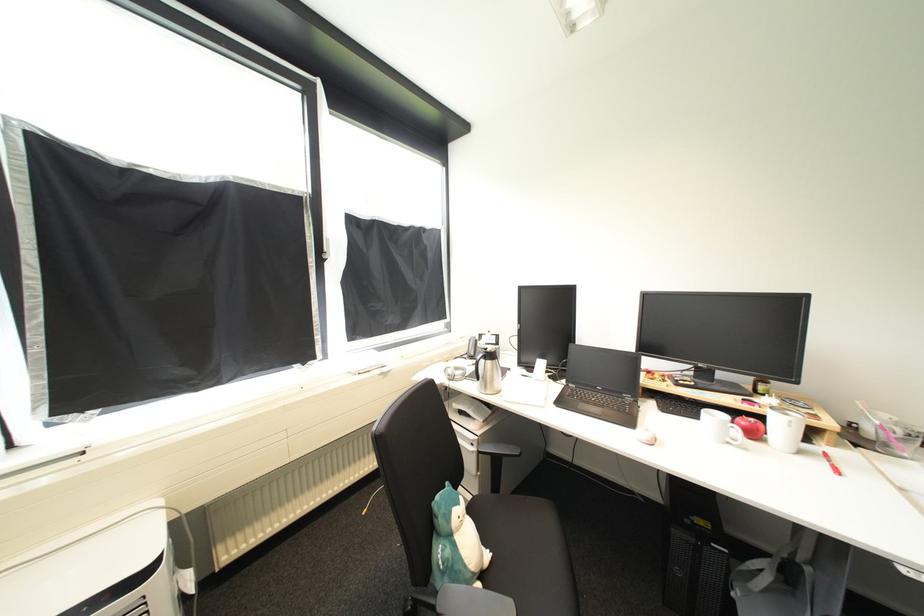
The width and height of the screenshot is (924, 616). What do you see at coordinates (526, 553) in the screenshot? I see `the chair sitting surface` at bounding box center [526, 553].